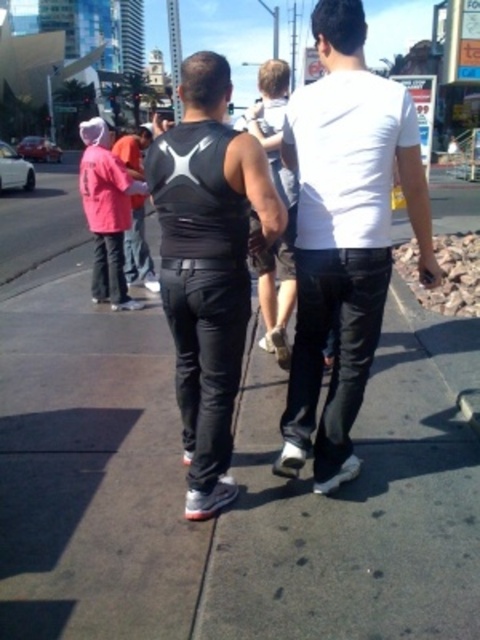
Which is in front, point (300, 432) or point (109, 276)?

Positioned in front is point (300, 432).

Which is behind, point (312, 227) or point (129, 202)?

The point (129, 202) is more distant.

What do you see at coordinates (345, 234) in the screenshot?
I see `white matte shirt at center` at bounding box center [345, 234].

Find the location of a particular element. This screenshot has width=480, height=640. white matte shirt at center is located at coordinates (345, 234).

Who is more distant from viewer, (79, 422) or (108, 276)?

Positioned behind is point (108, 276).

Does gray concrete sidewalk at center have a lesser height compared to pink fabric shirt at left?

Indeed, gray concrete sidewalk at center has a lesser height compared to pink fabric shirt at left.

Which is in front, point (153, 317) or point (115, 243)?

Point (153, 317) is in front.

The width and height of the screenshot is (480, 640). Find the location of `gray concrete sidewalk at center`. gray concrete sidewalk at center is located at coordinates (235, 504).

How much distance is there between black matte vest at center and pink fabric shirt at left?

The distance of black matte vest at center from pink fabric shirt at left is 1.86 meters.

Between black matte vest at center and pink fabric shirt at left, which one appears on the left side from the viewer's perspective?

pink fabric shirt at left is more to the left.

Does point (195, 436) lie in front of point (122, 220)?

Yes, point (195, 436) is closer to viewer.

Locate an element on the screen. The image size is (480, 640). black matte vest at center is located at coordinates (207, 266).